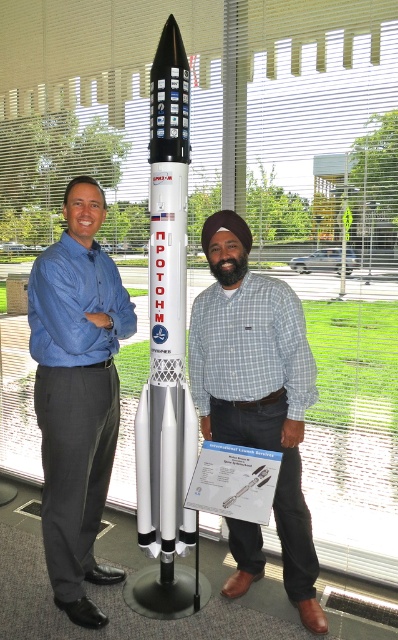
Who is more forward, [101,202] or [273,314]?

Point [273,314]

Looking at this image, which of these two, blue shirt at center or checkered shirt at center, stands shorter?

Standing shorter between the two is checkered shirt at center.

Between point (66, 356) and point (232, 404), which one is positioned behind?

The point (232, 404) is behind.

In order to click on blue shirt at center in this screenshot , I will do `click(76, 394)`.

From the picture: Can you confirm if blue shirt at center is shorter than white matte rocket at center?

Yes.

Locate an element on the screen. The width and height of the screenshot is (398, 640). blue shirt at center is located at coordinates (76, 394).

Who is more distant from viewer, (85, 432) or (179, 515)?

Positioned behind is point (179, 515).

Find the location of a particular element. blue shirt at center is located at coordinates (76, 394).

Can you confirm if checkered shirt at center is positioned to the right of white matte rocket at center?

Indeed, checkered shirt at center is positioned on the right side of white matte rocket at center.

Is point (284, 461) positioned in front of point (163, 49)?

Yes, it is in front of point (163, 49).

The height and width of the screenshot is (640, 398). I want to click on checkered shirt at center, so click(x=257, y=387).

Find the location of a particular element. The width and height of the screenshot is (398, 640). checkered shirt at center is located at coordinates pos(257,387).